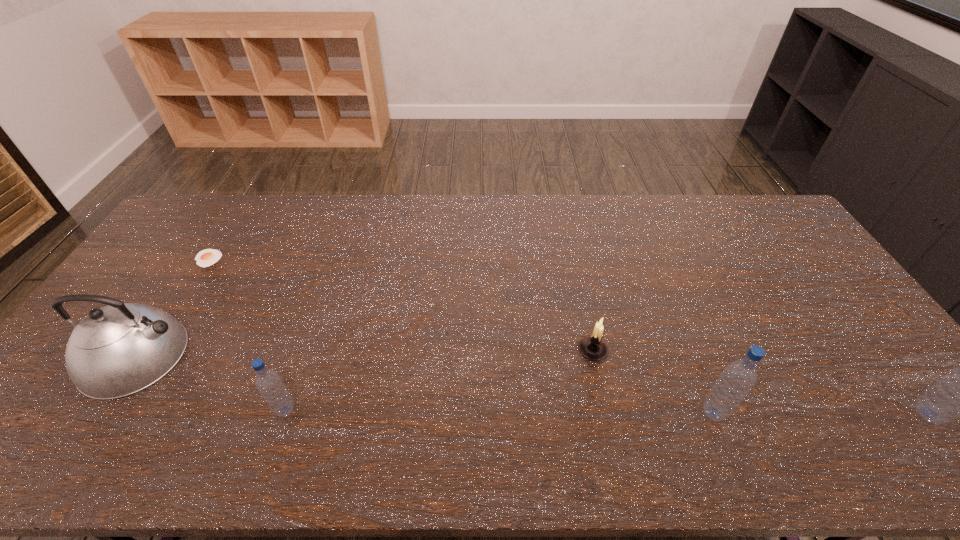
Locate an element on the screen. The width and height of the screenshot is (960, 540). vacant spot for a new water_bottle to ensure equal spacing is located at coordinates (499, 411).